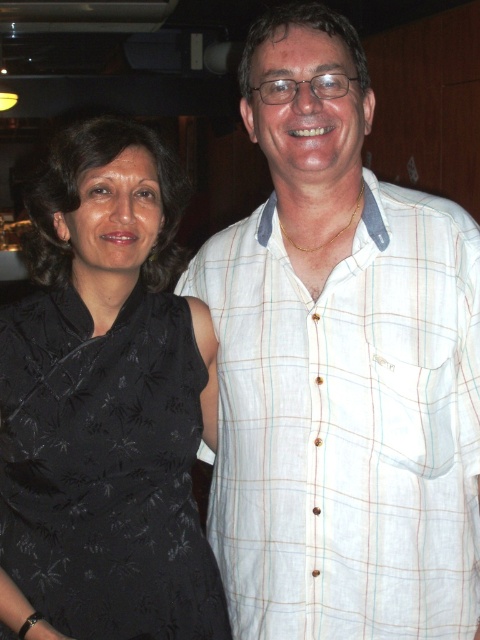
Question: Which object is closer to the camera taking this photo?

Choices:
 (A) white plaid shirt at right
 (B) black satin dress at left

Answer: (A)

Question: Which point is farther to the camera?

Choices:
 (A) white plaid shirt at right
 (B) black satin dress at left

Answer: (B)

Question: Can you confirm if white plaid shirt at right is positioned above black satin dress at left?

Choices:
 (A) yes
 (B) no

Answer: (A)

Question: Can you confirm if white plaid shirt at right is positioned to the right of black satin dress at left?

Choices:
 (A) no
 (B) yes

Answer: (B)

Question: Can you confirm if white plaid shirt at right is positioned above black satin dress at left?

Choices:
 (A) yes
 (B) no

Answer: (A)